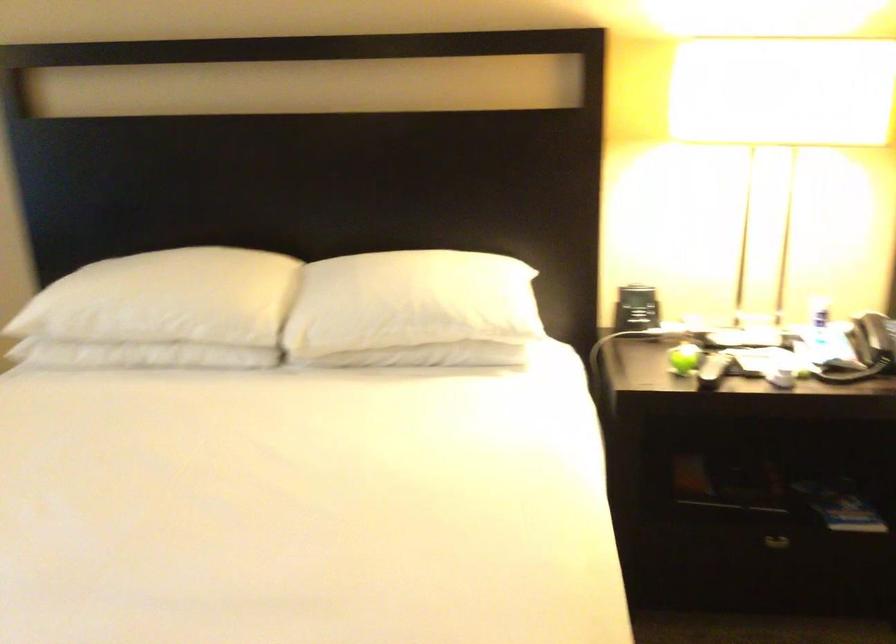
Find where to lift the telephone receiver. Please return your answer as a coordinate pair (x, y).

(874, 336)